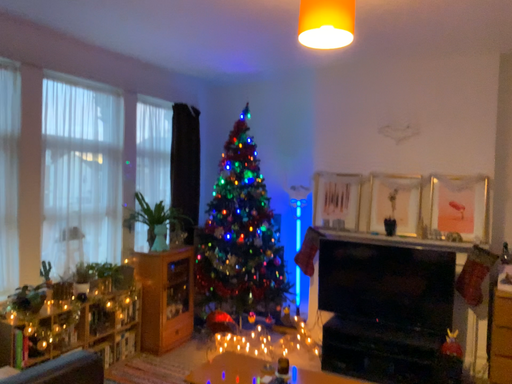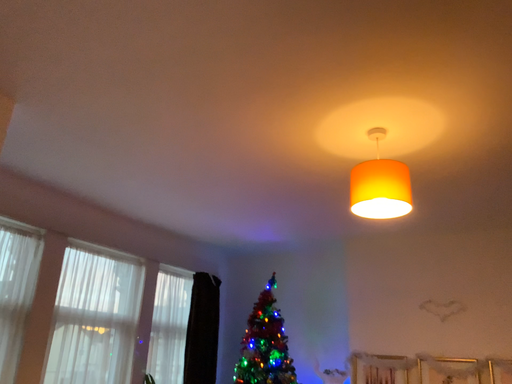
Question: How did the camera likely rotate when shooting the video?

Choices:
 (A) rotated upward
 (B) rotated downward

Answer: (A)